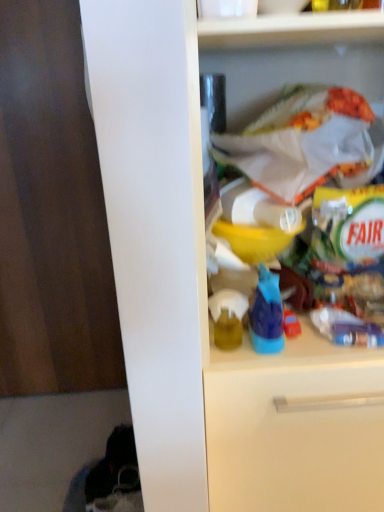
Question: In terms of height, does blue plastic bottle at center look taller or shorter compared to matte yellow bottle at center?

Choices:
 (A) tall
 (B) short

Answer: (A)

Question: From the image's perspective, is blue plastic bottle at center located above or below matte yellow bottle at center?

Choices:
 (A) below
 (B) above

Answer: (B)

Question: Which of these objects is positioned farthest from the dark wood door at left?

Choices:
 (A) matte yellow bottle at center
 (B) blue plastic bottle at center
 (C) white plastic bag at upper right

Answer: (B)

Question: Which of these objects is positioned closest to the dark wood door at left?

Choices:
 (A) blue plastic bottle at center
 (B) matte yellow bottle at center
 (C) white plastic bag at upper right

Answer: (C)